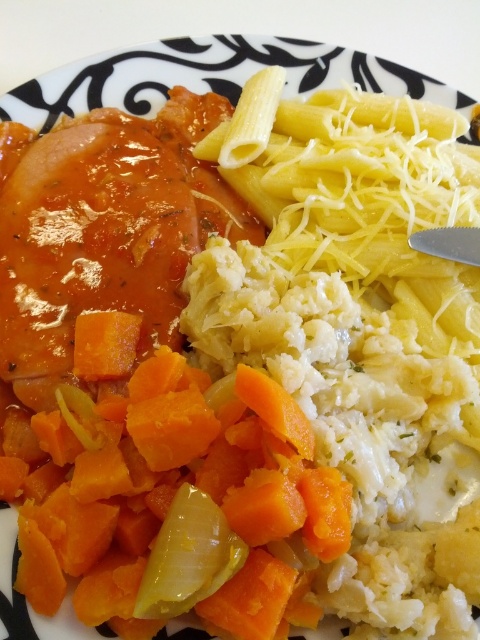
You are a food critic evaluating the arrangement of vegetables on this plate. The orange smooth carrot at left and the yellow translucent onion at lower center are part of the dish. Which vegetable is positioned higher on the plate?

The orange smooth carrot at left is taller than the yellow translucent onion at lower center, so it is positioned higher on the plate.

You are standing 1 meter away from a plate of food. There is a point at coordinates point (136, 557) on the plate. Can you reach this point without moving closer to the plate?

The distance of point (136, 557) is 1.12 meters from the viewer, so you are currently 1 meter away. Since 1.12 meters is farther than your current distance, you need to move closer to reach the point.

You are a food critic examining the plate. The orange smooth carrot at left and the yellow translucent onion at lower center are both present. Which vegetable is positioned higher on the plate?

The orange smooth carrot at left is positioned higher on the plate than the yellow translucent onion at lower center.